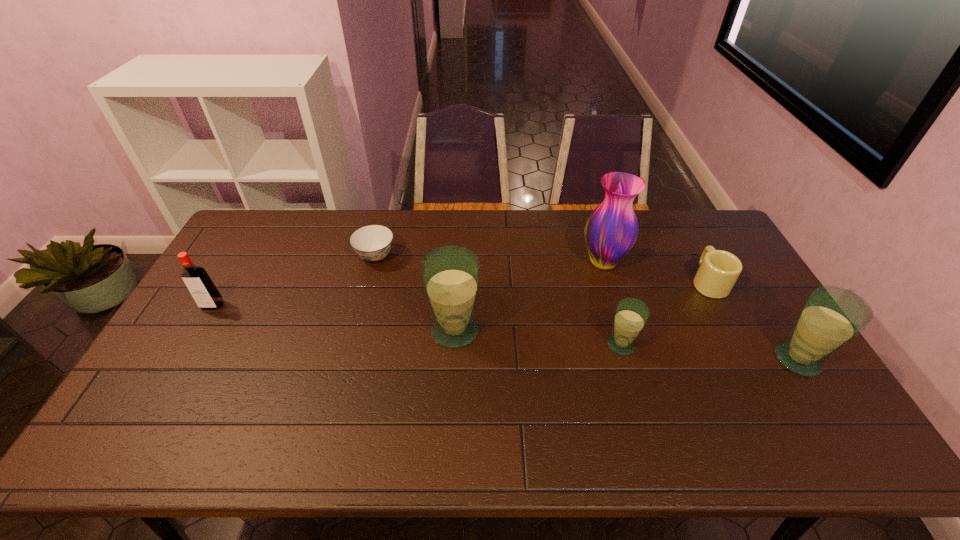
The glasss are evenly distributed in the image. To maintain this, where would you place another glass on the left? Please point to a free space. Please provide its 2D coordinates. Your answer should be formatted as a tuple, i.e. [(x, y)], where the tuple contains the x and y coordinates of a point satisfying the conditions above.

[(298, 318)]